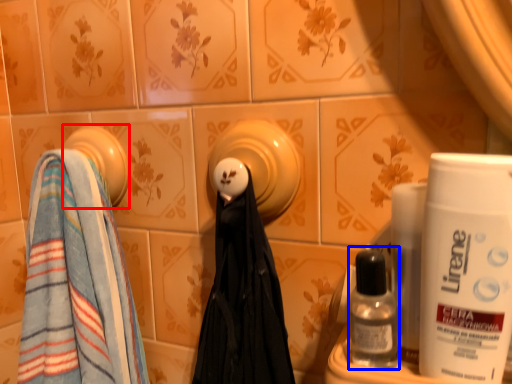
Question: Among these objects, which one is farthest to the camera, towel (highlighted by a red box) or mouthwash (highlighted by a blue box)?

Choices:
 (A) towel
 (B) mouthwash

Answer: (A)